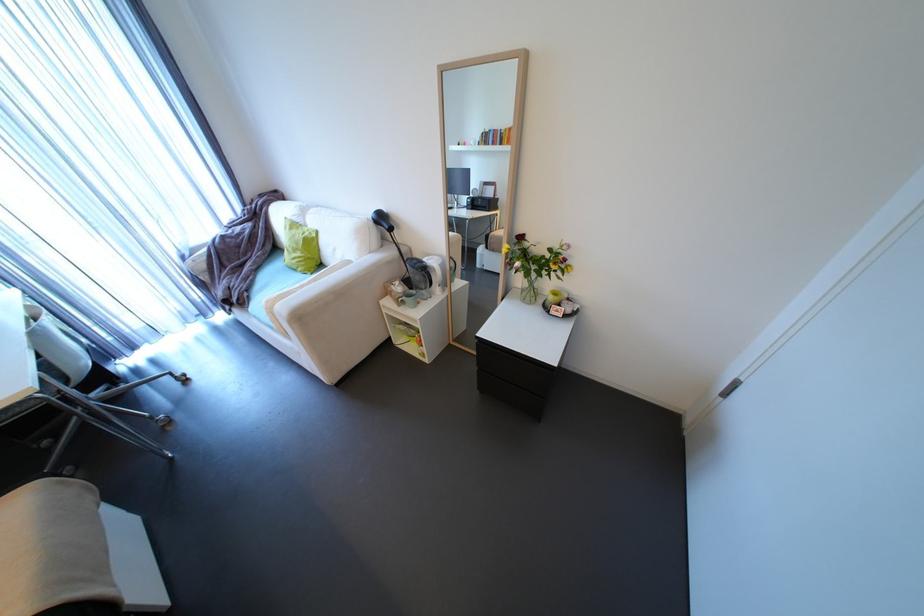
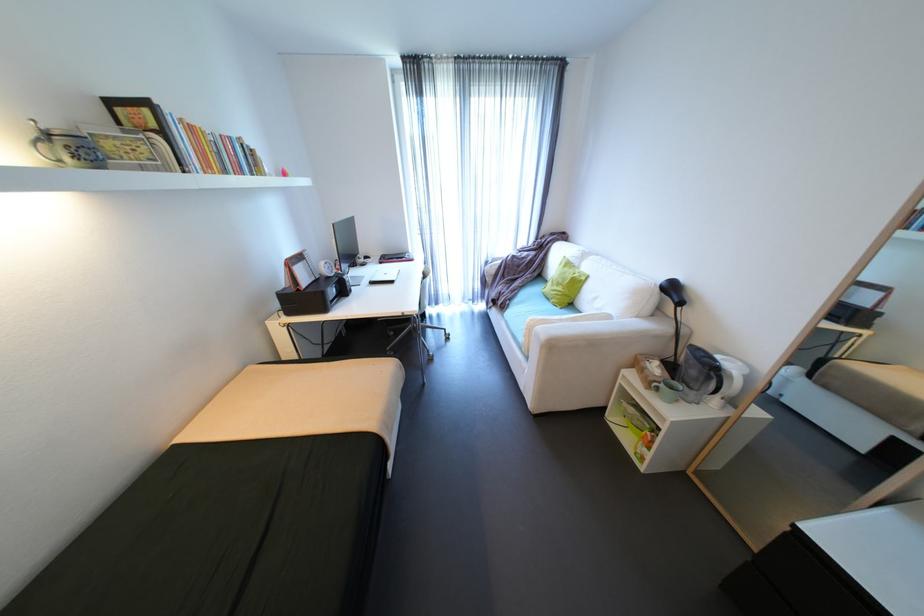
Question: The camera is either moving clockwise (left) or counter-clockwise (right) around the object. The first image is from the beginning of the video and the second image is from the end. Is the camera moving left or right when shooting the video?

Choices:
 (A) Left
 (B) Right

Answer: (B)